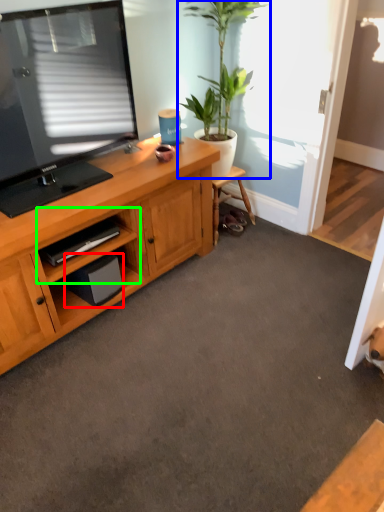
Question: Estimate the real-world distances between objects in this image. Which object is farther from speaker (highlighted by a red box), houseplant (highlighted by a blue box) or cabinet (highlighted by a green box)?

Choices:
 (A) houseplant
 (B) cabinet

Answer: (A)